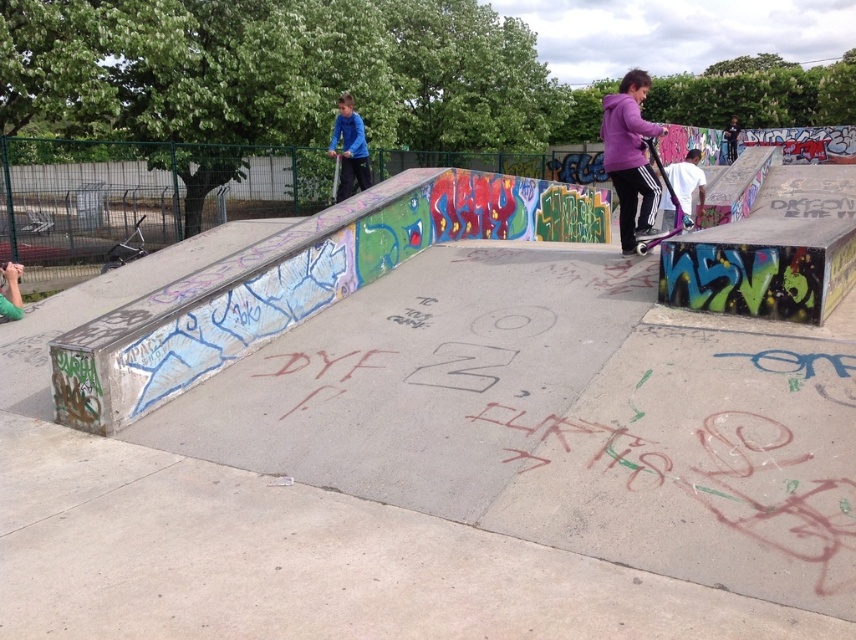
Question: Which object appears closest to the camera in this image?

Choices:
 (A) blue matte shirt at upper center
 (B) metallic purple skateboard at center

Answer: (A)

Question: Is blue matte shirt at upper center bigger than metallic purple skateboard at center?

Choices:
 (A) yes
 (B) no

Answer: (B)

Question: Which object is positioned farthest from the blue matte shirt at upper center?

Choices:
 (A) metallic purple skateboard at center
 (B) metallic blue skateboard at center
 (C) metallic purple scooter at center-right

Answer: (B)

Question: Which object appears farthest from the camera in this image?

Choices:
 (A) metallic blue skateboard at center
 (B) metallic purple skateboard at center
 (C) metallic purple scooter at center-right

Answer: (B)

Question: Can you confirm if metallic purple scooter at center-right is positioned to the left of metallic blue skateboard at center?

Choices:
 (A) no
 (B) yes

Answer: (B)

Question: Is metallic purple scooter at center-right to the right of metallic purple skateboard at center from the viewer's perspective?

Choices:
 (A) no
 (B) yes

Answer: (B)